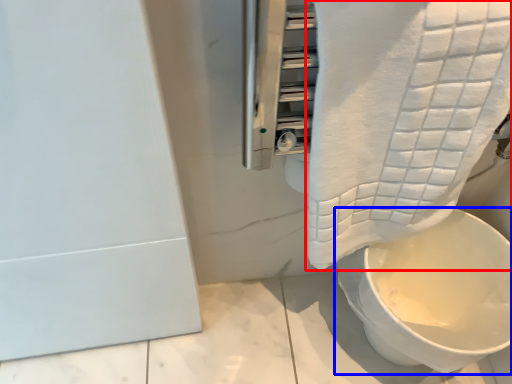
Question: Among these objects, which one is farthest to the camera, towel (highlighted by a red box) or toilet (highlighted by a blue box)?

Choices:
 (A) towel
 (B) toilet

Answer: (B)